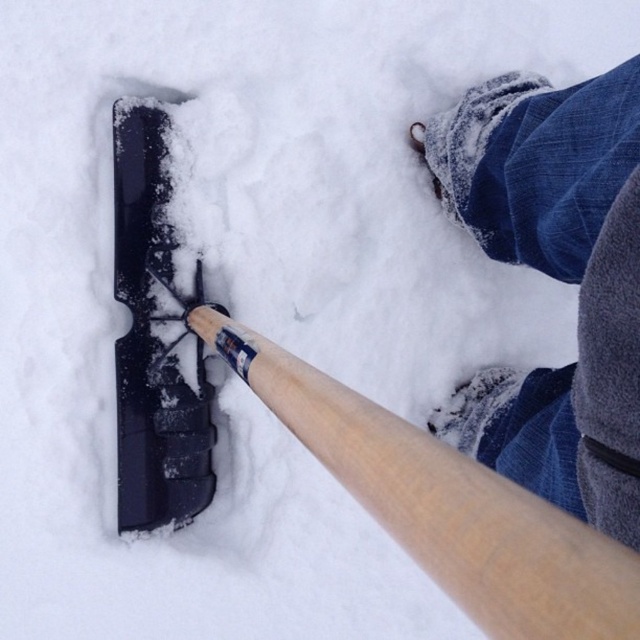
Question: Which of the following is the closest to the observer?

Choices:
 (A) blue denim jeans at lower right
 (B) denim pants at lower right
 (C) wooden baseball bat at lower left

Answer: (C)

Question: Which point appears farthest from the camera in this image?

Choices:
 (A) coord(516,388)
 (B) coord(156,161)
 (C) coord(381,508)
 (D) coord(544,218)

Answer: (B)

Question: Does wooden baseball bat at lower left have a lesser width compared to black plastic shovel at lower left?

Choices:
 (A) no
 (B) yes

Answer: (A)

Question: Can you confirm if wooden baseball bat at lower left is positioned above blue denim jeans at lower right?

Choices:
 (A) yes
 (B) no

Answer: (A)

Question: Among these points, which one is farthest from the camera?

Choices:
 (A) (580, 429)
 (B) (118, 212)

Answer: (B)

Question: Is wooden baseball bat at lower left to the right of black plastic shovel at lower left from the viewer's perspective?

Choices:
 (A) yes
 (B) no

Answer: (A)